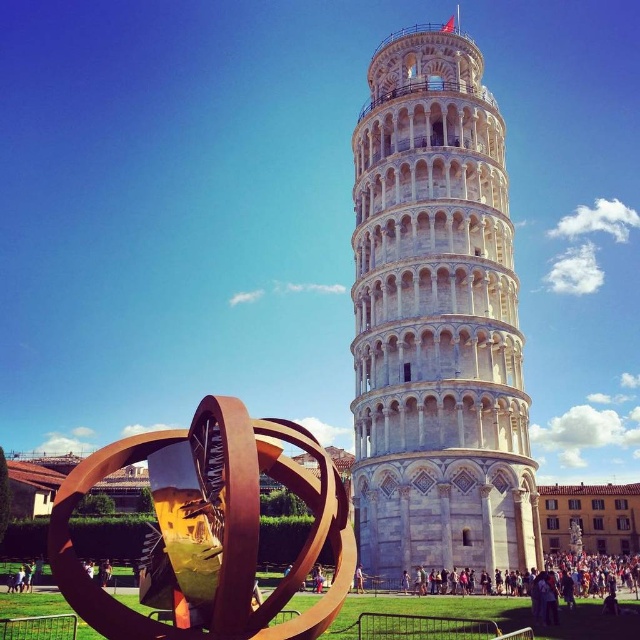
You are a tourist visiting the Leaning Tower of Pisa and want to take a photo that includes both the white stone tower at center and the rusty metal sphere at lower left. Which object should you position closer to the camera to ensure both are in focus?

The white stone tower at center is much taller than the rusty metal sphere at lower left, so positioning the rusty metal sphere at lower left closer to the camera will help keep both objects in focus.

Based on the photo, you are standing in front of the Leaning Tower of Pisa and want to take a photo that includes both the point at coordinates point (376, 145) and the point at coordinates point (156, 442). Since you want to ensure both points are in focus, which point should you focus on to capture both in your shot?

You should focus on point (156, 442) because it is farther away from you than point (376, 145), so focusing on the farther point will ensure both are in focus.